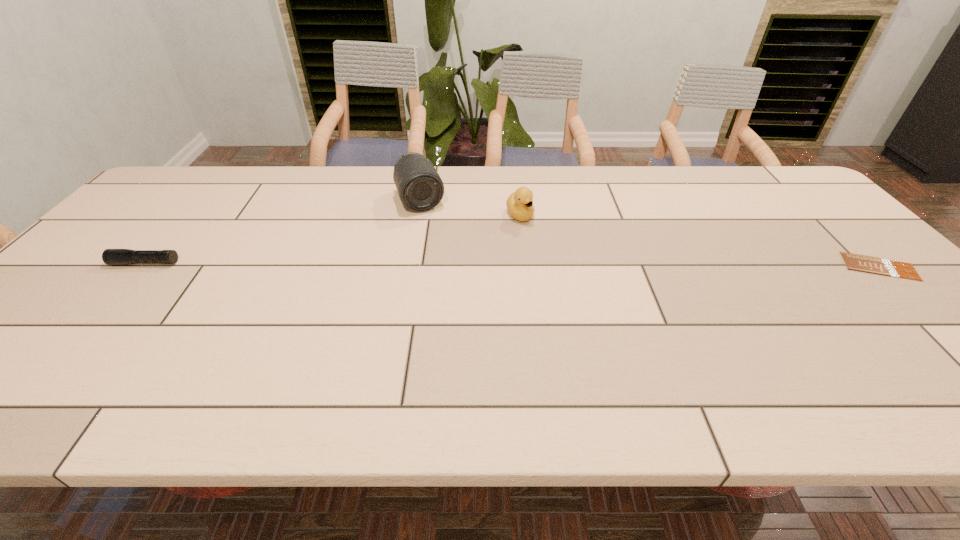
The height and width of the screenshot is (540, 960). In the image, there is a desktop. What are the coordinates of `vacant space at the left edge` in the screenshot? It's located at (189, 211).

Identify the location of vacant space at the right edge of the desktop. (845, 283).

Identify the location of unoccupied area between the second tallest object and the leftmost object. Image resolution: width=960 pixels, height=540 pixels. (332, 239).

At what (x,y) coordinates should I click in order to perform the action: click on empty location between the telephoto lens and the duckling. Please return your answer as a coordinate pair (x, y). This screenshot has height=540, width=960. Looking at the image, I should click on (470, 208).

I want to click on empty space between the leftmost object and the telephoto lens, so click(x=282, y=232).

At what (x,y) coordinates should I click in order to perform the action: click on free point between the third shortest object and the chocolate bar. Please return your answer as a coordinate pair (x, y). This screenshot has width=960, height=540. Looking at the image, I should click on (700, 241).

Locate an element on the screen. vacant area that lies between the second object from right to left and the shortest object is located at coordinates (700, 241).

At what (x,y) coordinates should I click in order to perform the action: click on blank region between the second tallest object and the telephoto lens. Please return your answer as a coordinate pair (x, y). The image size is (960, 540). Looking at the image, I should click on coord(470,208).

Identify the location of free space between the third object from left to right and the rightmost object. Image resolution: width=960 pixels, height=540 pixels. click(700, 241).

Locate an element on the screen. Image resolution: width=960 pixels, height=540 pixels. unoccupied position between the third tallest object and the duckling is located at coordinates 332,239.